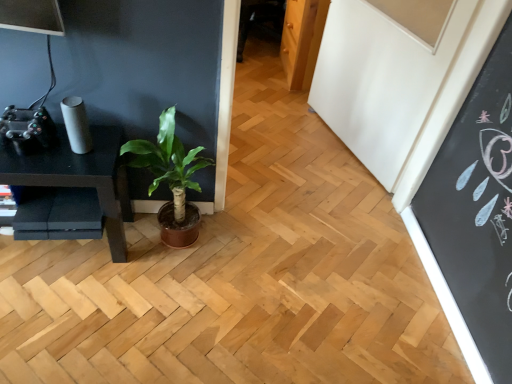
Question: Can you confirm if green leafy plant at center is bigger than black matte table at left?

Choices:
 (A) yes
 (B) no

Answer: (B)

Question: Can you confirm if green leafy plant at center is thinner than black matte table at left?

Choices:
 (A) no
 (B) yes

Answer: (A)

Question: From the image's perspective, is green leafy plant at center on top of black matte table at left?

Choices:
 (A) yes
 (B) no

Answer: (A)

Question: Is green leafy plant at center facing towards black matte table at left?

Choices:
 (A) no
 (B) yes

Answer: (A)

Question: Can you confirm if green leafy plant at center is wider than black matte table at left?

Choices:
 (A) no
 (B) yes

Answer: (B)

Question: From a real-world perspective, does green leafy plant at center sit lower than black matte table at left?

Choices:
 (A) no
 (B) yes

Answer: (A)

Question: Is black matte table at left oriented away from green leafy plant at center?

Choices:
 (A) yes
 (B) no

Answer: (B)

Question: Is black matte table at left further to camera compared to green leafy plant at center?

Choices:
 (A) no
 (B) yes

Answer: (B)

Question: Does black matte table at left have a lesser height compared to green leafy plant at center?

Choices:
 (A) yes
 (B) no

Answer: (A)

Question: Are black matte table at left and green leafy plant at center making contact?

Choices:
 (A) yes
 (B) no

Answer: (B)

Question: Is black matte table at left in front of green leafy plant at center?

Choices:
 (A) yes
 (B) no

Answer: (B)

Question: From a real-world perspective, is black matte table at left positioned over green leafy plant at center based on gravity?

Choices:
 (A) no
 (B) yes

Answer: (A)

Question: From their relative heights in the image, would you say green leafy plant at center is taller or shorter than black matte table at left?

Choices:
 (A) tall
 (B) short

Answer: (A)